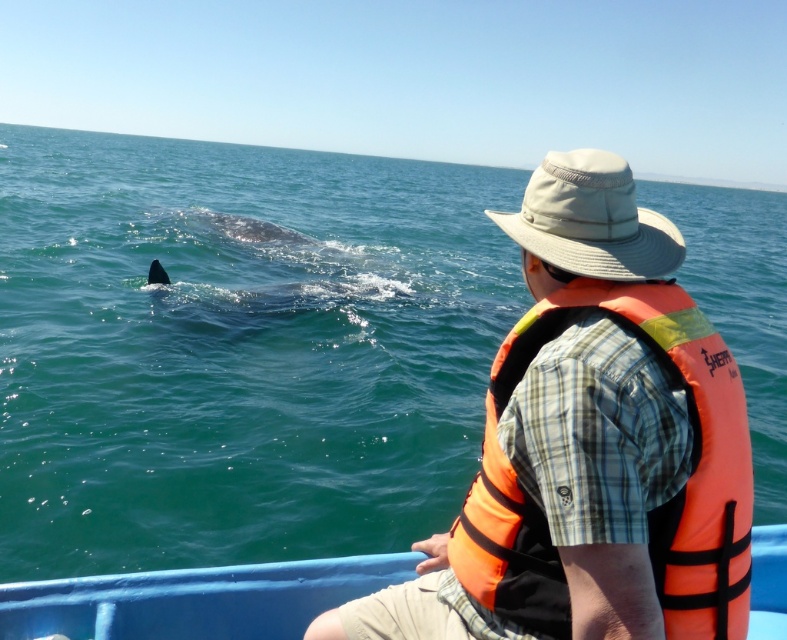
Question: From the image, what is the correct spatial relationship of blue plastic boat at center in relation to beige fabric hat at upper right?

Choices:
 (A) below
 (B) above

Answer: (A)

Question: Considering the real-world distances, which object is closest to the beige fabric hat at upper right?

Choices:
 (A) blue plastic boat at center
 (B) green water at whale left
 (C) orange fabric life vest at right

Answer: (C)

Question: Which point is closer to the camera?

Choices:
 (A) (427, 314)
 (B) (274, 621)
 (C) (699, 596)

Answer: (C)

Question: Is green water at whale left bigger than blue plastic boat at center?

Choices:
 (A) no
 (B) yes

Answer: (B)

Question: Is blue plastic boat at center closer to camera compared to beige fabric hat at upper right?

Choices:
 (A) yes
 (B) no

Answer: (B)

Question: Which object appears closest to the camera in this image?

Choices:
 (A) beige fabric hat at upper right
 (B) orange fabric life vest at right
 (C) green water at whale left

Answer: (B)